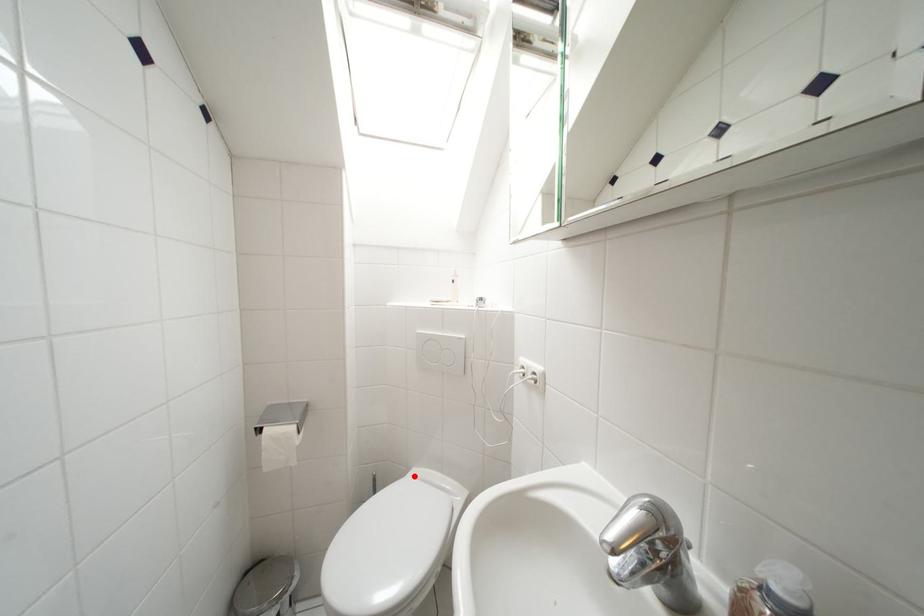
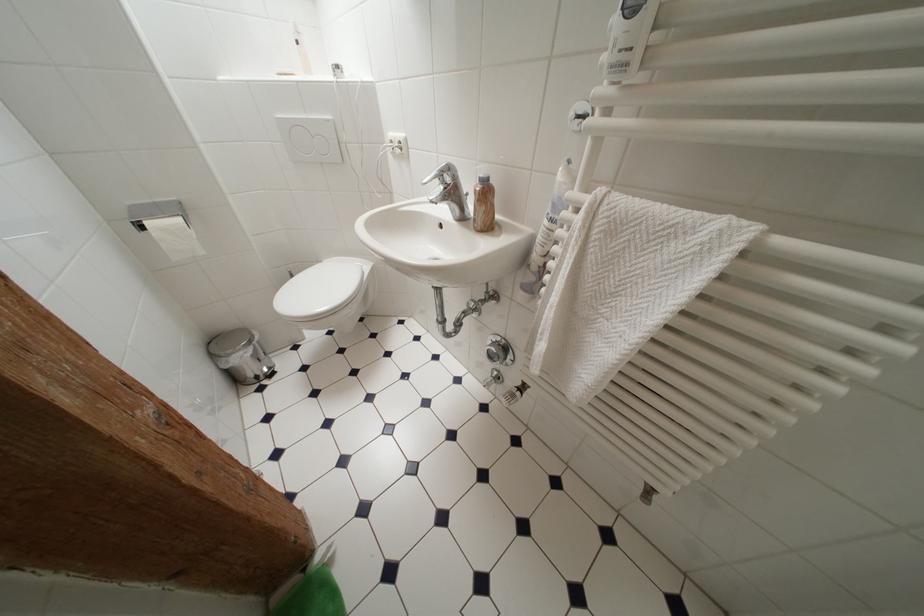
Question: I am providing you with two images of the same scene from different viewpoints. A red point is shown in image1. For the corresponding object point in image2, is it positioned nearer or farther from the camera?

Choices:
 (A) Nearer
 (B) Farther

Answer: (B)